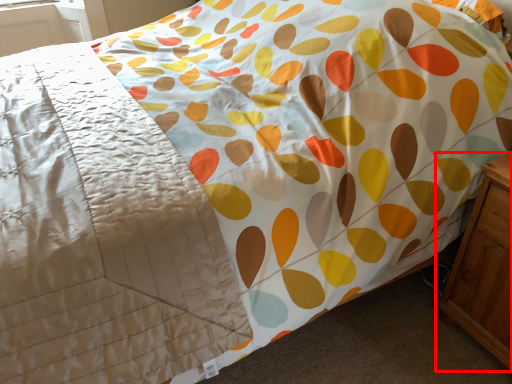
Question: From the image, what is the correct spatial relationship of nightstand (annotated by the red box) in relation to blanket?

Choices:
 (A) right
 (B) left

Answer: (A)